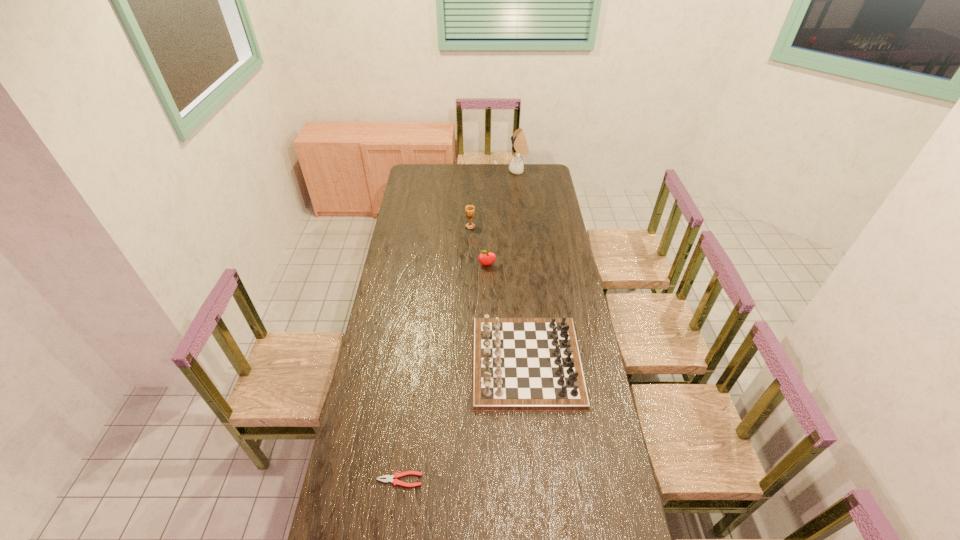
Locate an element on the screen. object at the far right corner is located at coordinates (519, 144).

Locate an element on the screen. Image resolution: width=960 pixels, height=540 pixels. free location at the left edge of the desktop is located at coordinates (389, 413).

Identify the location of vacant space at the right edge of the desktop. (549, 269).

Identify the location of vacant space at the far right corner of the desktop. (551, 169).

Where is `free space between the chalice and the chessboard`? This screenshot has width=960, height=540. free space between the chalice and the chessboard is located at coordinates (498, 294).

This screenshot has height=540, width=960. What are the coordinates of `free point between the third farthest object and the farthest object` in the screenshot? It's located at (503, 218).

Image resolution: width=960 pixels, height=540 pixels. I want to click on empty space between the chessboard and the farthest object, so click(x=522, y=266).

Identify the location of free spot between the nearest object and the chessboard. (464, 421).

Locate an element on the screen. This screenshot has height=540, width=960. vacant area between the farthest object and the shortest object is located at coordinates (459, 326).

Image resolution: width=960 pixels, height=540 pixels. Find the location of `vacant area that lies between the nearest object and the third farthest object`. vacant area that lies between the nearest object and the third farthest object is located at coordinates tap(444, 373).